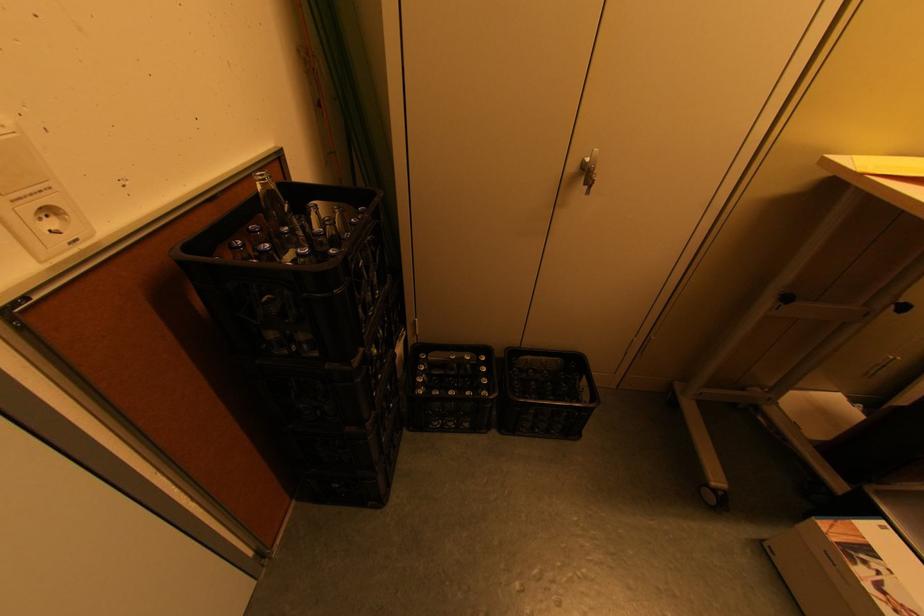
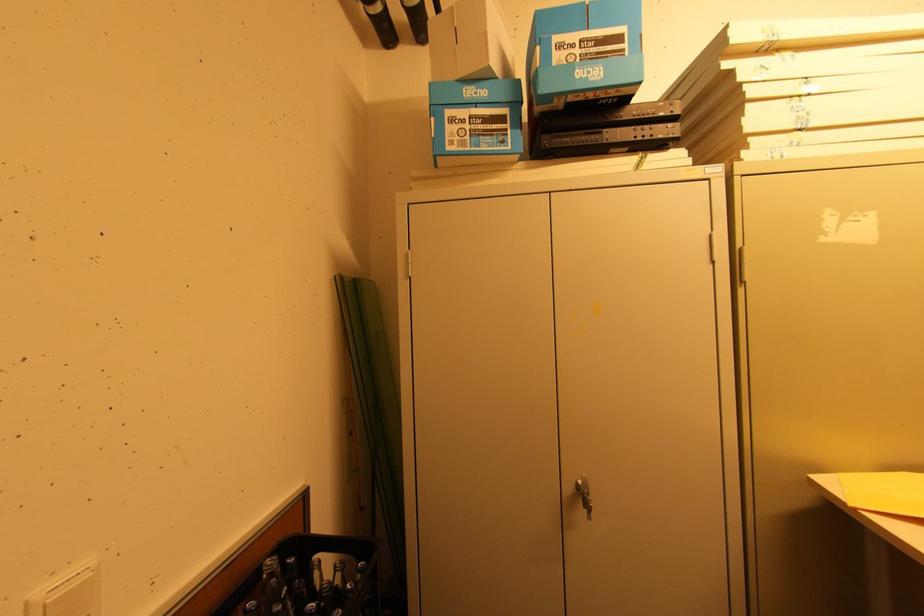
Find the pixel in the second image that matches (307,217) in the first image.

(306, 582)